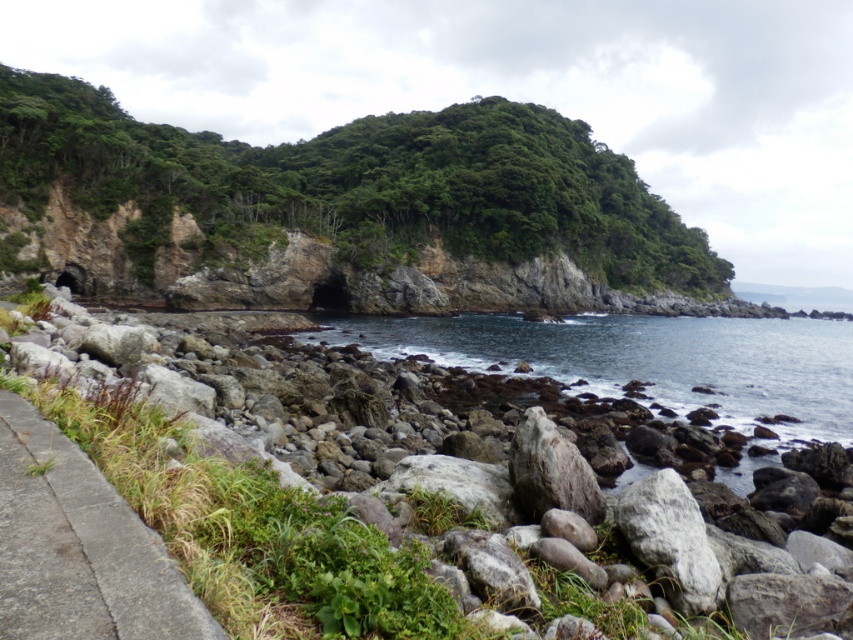
You are standing at the rocky shoreline and want to take a photo of both the point at coordinates point (418, 180) and the point at coordinates point (206, 621). Which point should you focus on first to ensure both are in the same frame?

You should focus on the point at coordinates point (418, 180) first because it is closer to you than the point at coordinates point (206, 621), ensuring both are within the frame.

You are standing at point (167,560) and want to walk to point (749,396). Based on the scene description, which direction should you move relative to the coastal path?

You should move towards the background direction relative to the coastal path because point (749,396) is behind point (167,560).